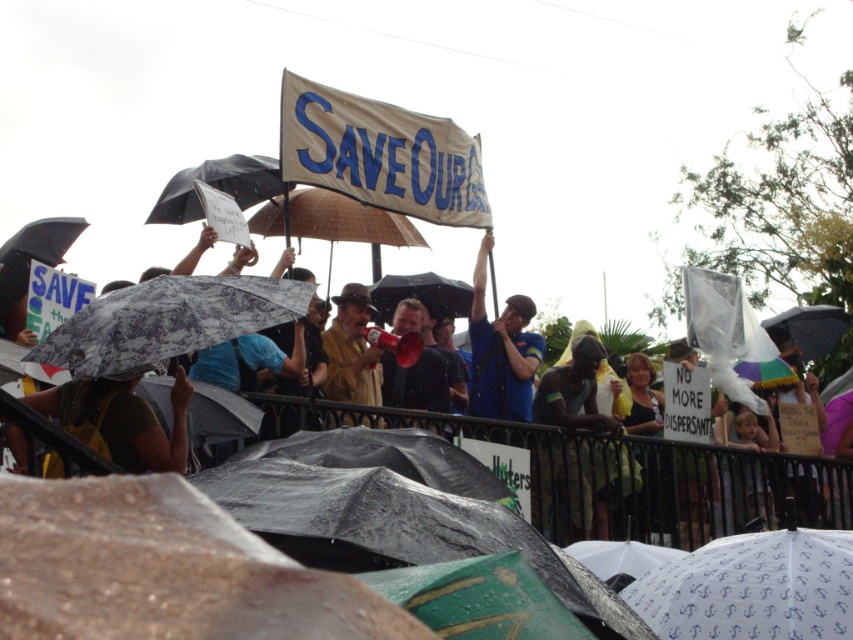
Question: Is dark skin figure at center thinner than dark blue shirt at center?

Choices:
 (A) yes
 (B) no

Answer: (B)

Question: Is dark skin figure at center closer to the viewer compared to dark blue shirt at center?

Choices:
 (A) no
 (B) yes

Answer: (B)

Question: Which object appears farthest from the camera in this image?

Choices:
 (A) patterned fabric umbrella at center
 (B) dark blue shirt at center
 (C) dark skin figure at center

Answer: (B)

Question: Estimate the real-world distances between objects in this image. Which object is closer to the white printed umbrella at lower right?

Choices:
 (A) transparent plastic umbrella at upper center
 (B) brown leather jacket at center
 (C) green matte shirt at lower left

Answer: (C)

Question: Which point is farther from the camera taking this photo?

Choices:
 (A) pyautogui.click(x=350, y=330)
 (B) pyautogui.click(x=821, y=595)
 (C) pyautogui.click(x=502, y=384)
 (D) pyautogui.click(x=186, y=168)

Answer: (D)

Question: Is the position of green matte shirt at lower left more distant than that of dark blue shirt at center?

Choices:
 (A) yes
 (B) no

Answer: (B)